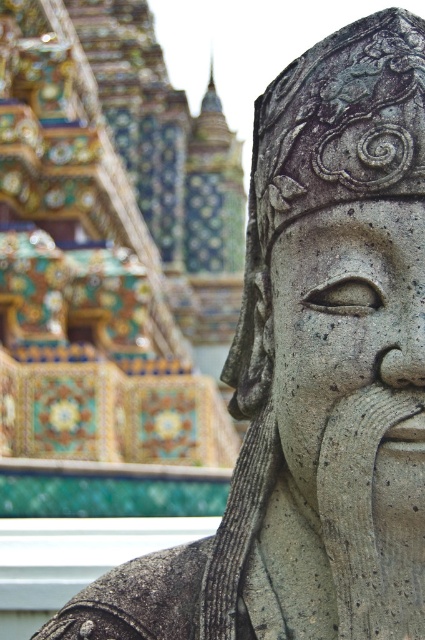
You are an art student analyzing the statue in the image. You notice two parts of the statue labeled as the gray stone head at center and the gray stone face at center. Which one is positioned to the left?

The gray stone head at center is positioned to the left of the gray stone face at center.

You are standing in front of the statue and want to touch both points on it. Which point should you reach for first, the one at point [252,422] or the one at point [353,291]?

You should reach for point [252,422] first because it is closer to you than point [353,291].